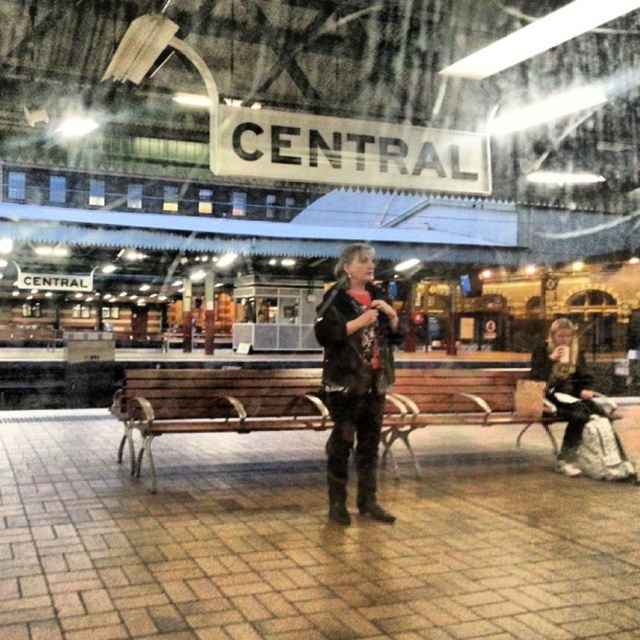
You are standing at the entrance of the Central station platform. You need to find the brown wooden bench at center to rest. According to the station layout, where should you head towards based on the coordinates provided?

The brown wooden bench at center is located at point (214, 404), so you should head towards those coordinates to find it.

You are a photographer setting up a photo shoot at the Central train station platform. You need to place a tripod between the brown wooden bench at center and the leather jacket at center. Which object should you position the tripod closer to to ensure it fits within the available space?

The brown wooden bench at center is wider than the leather jacket at center. To ensure the tripod fits within the available space, position it closer to the leather jacket at center since it occupies less width.

You are standing at point [369,268] in the train station. You need to walk to point [113,413]. Is the direction you should walk towards the platform entrance or away from it?

Point [113,413] is behind point [369,268], so you should walk away from the platform entrance to reach it.